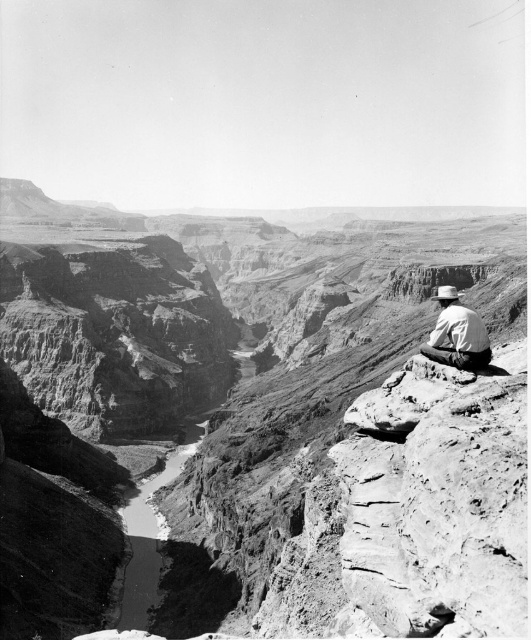
Question: Which object appears farthest from the camera in this image?

Choices:
 (A) white felt cowboy hat at right
 (B) rugged rock canyon at center

Answer: (B)

Question: Based on their relative distances, which object is farther from the light brown leather hat at center?

Choices:
 (A) rugged rock canyon at center
 (B) white felt cowboy hat at right

Answer: (A)

Question: Which of the following is the closest to the observer?

Choices:
 (A) (450, 314)
 (B) (439, 291)

Answer: (A)

Question: Observing the image, what is the correct spatial positioning of light brown leather hat at center in reference to white felt cowboy hat at right?

Choices:
 (A) above
 (B) below

Answer: (B)

Question: Where is rugged rock canyon at center located in relation to light brown leather hat at center in the image?

Choices:
 (A) above
 (B) below

Answer: (A)

Question: Is light brown leather hat at center above white felt cowboy hat at right?

Choices:
 (A) yes
 (B) no

Answer: (B)